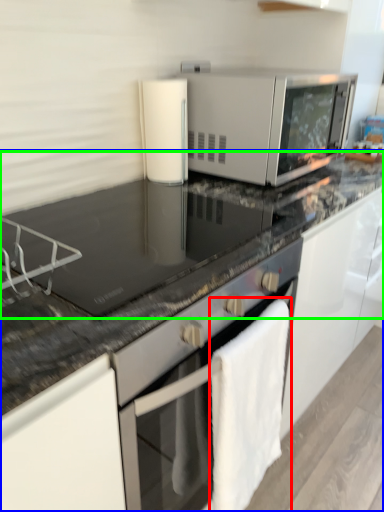
Question: Which object is positioned closest to bath towel (highlighted by a red box)? Select from countertop (highlighted by a blue box) and countertop (highlighted by a green box).

Choices:
 (A) countertop
 (B) countertop

Answer: (A)